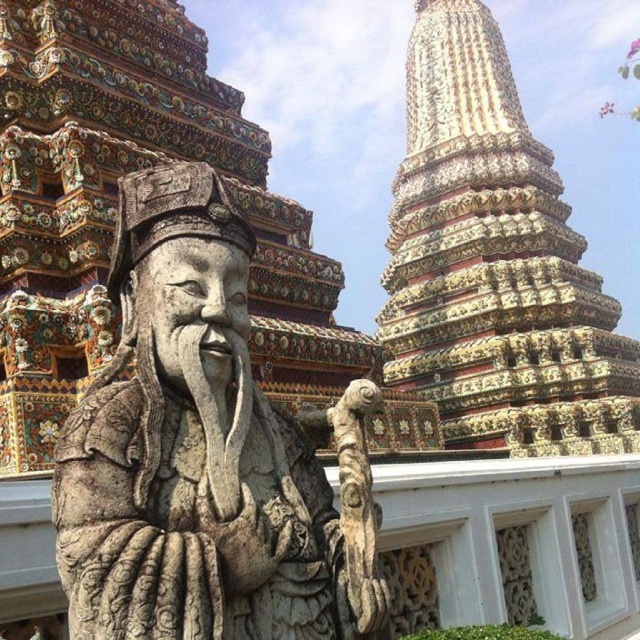
At what (x,y) coordinates should I click in order to perform the action: click on stone statue at center. Please return your answer as a coordinate pair (x, y). Looking at the image, I should click on (205, 452).

Between stone statue at center and carved stone tower at upper right, which one appears on the left side from the viewer's perspective?

From the viewer's perspective, stone statue at center appears more on the left side.

Who is more forward, (195, 164) or (440, 248)?

Point (195, 164) is more forward.

You are a GUI agent. You are given a task and a screenshot of the screen. Output one action in this format:
    pyautogui.click(x=<x>, y=<y>)
    Task: Click on the stone statue at center
    The height and width of the screenshot is (640, 640).
    Given the screenshot: What is the action you would take?
    pyautogui.click(x=205, y=452)